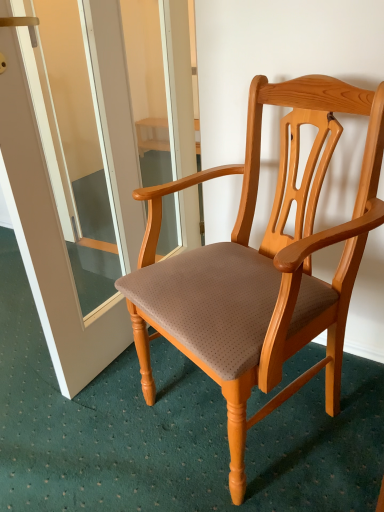
You are a GUI agent. You are given a task and a screenshot of the screen. Output one action in this format:
    pyautogui.click(x=<x>, y=<y>)
    Task: Click on the free space below light brown wood chair at center (from a real-world perspective)
    
    Given the screenshot: What is the action you would take?
    pyautogui.click(x=223, y=433)